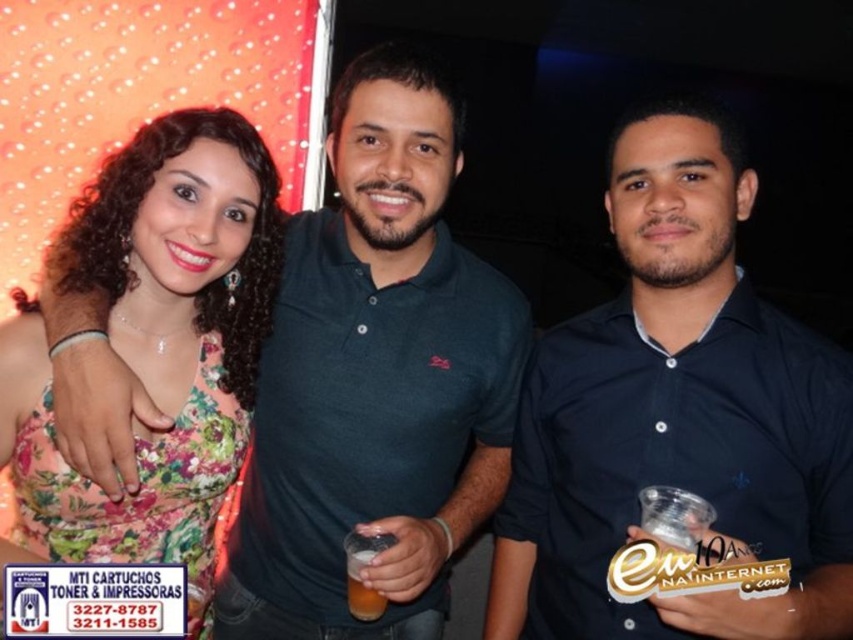
Question: Considering the relative positions of dark blue polo shirt at center and floral fabric dress at center in the image provided, where is dark blue polo shirt at center located with respect to floral fabric dress at center?

Choices:
 (A) right
 (B) left

Answer: (A)

Question: Which point is closer to the camera?

Choices:
 (A) (747, 509)
 (B) (231, 280)

Answer: (A)

Question: Does dark green polo shirt at center have a smaller size compared to floral fabric dress at center?

Choices:
 (A) yes
 (B) no

Answer: (B)

Question: Which point is farther from the camera taking this photo?

Choices:
 (A) (100, 196)
 (B) (596, 577)
 (C) (376, 596)
 (D) (430, 369)

Answer: (D)

Question: Can you confirm if floral fabric dress at center is positioned above translucent plastic cup at center?

Choices:
 (A) yes
 (B) no

Answer: (A)

Question: Among these points, which one is nearest to the camera?

Choices:
 (A) (782, 451)
 (B) (103, 260)
 (C) (364, 588)

Answer: (C)